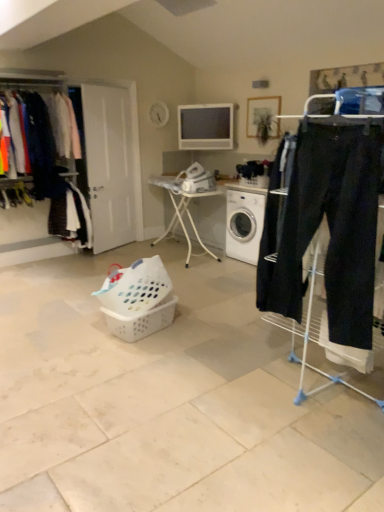
Where is `vacant point to the right of white plastic basket at center, which is the 2th basket from top to bottom`? vacant point to the right of white plastic basket at center, which is the 2th basket from top to bottom is located at coordinates (204, 327).